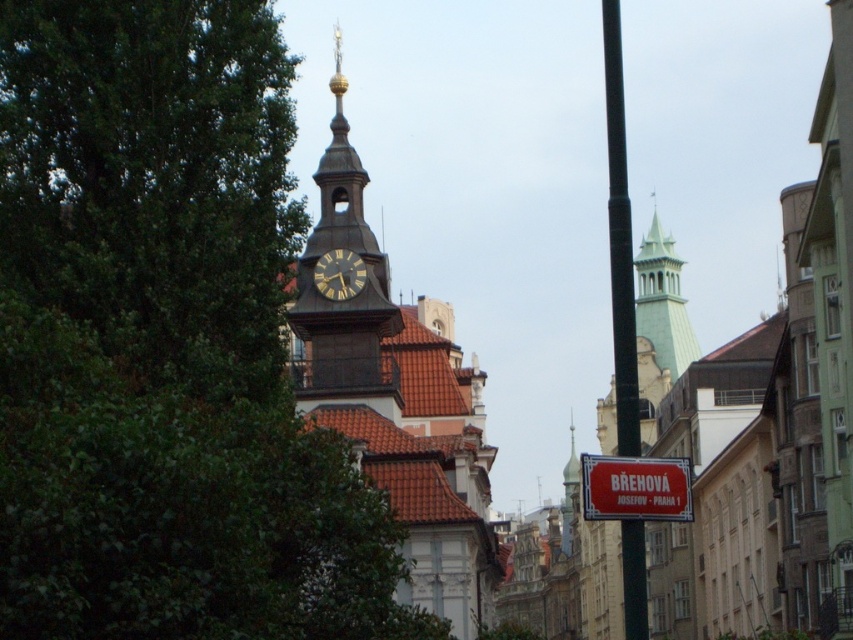
Does black metal pole at right appear over red plastic street sign at center?

Indeed, black metal pole at right is positioned over red plastic street sign at center.

Image resolution: width=853 pixels, height=640 pixels. What do you see at coordinates (619, 241) in the screenshot? I see `black metal pole at right` at bounding box center [619, 241].

Which is in front, point (627, 276) or point (621, 465)?

Point (621, 465) is more forward.

Identify the location of black metal pole at right. The image size is (853, 640). (619, 241).

Is the position of dark brown stone clock tower at center less distant than that of green glass spire at upper right?

Yes, it is in front of green glass spire at upper right.

Between dark brown stone clock tower at center and green glass spire at upper right, which one has more height?

dark brown stone clock tower at center

Is point (321, 228) farther from viewer compared to point (645, 285)?

No, (321, 228) is in front of (645, 285).

Where is `dark brown stone clock tower at center`? dark brown stone clock tower at center is located at coordinates (343, 282).

Who is more forward, (669, 346) or (354, 269)?

Point (354, 269) is more forward.

Which is behind, point (636, 316) or point (347, 253)?

Point (636, 316)

Where is `green glass spire at upper right`? The width and height of the screenshot is (853, 640). green glass spire at upper right is located at coordinates (662, 301).